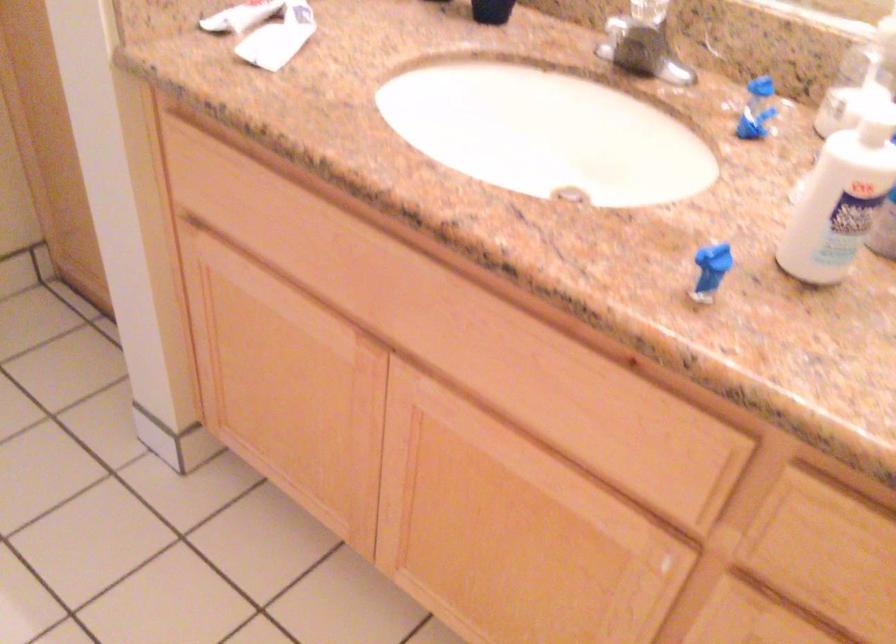
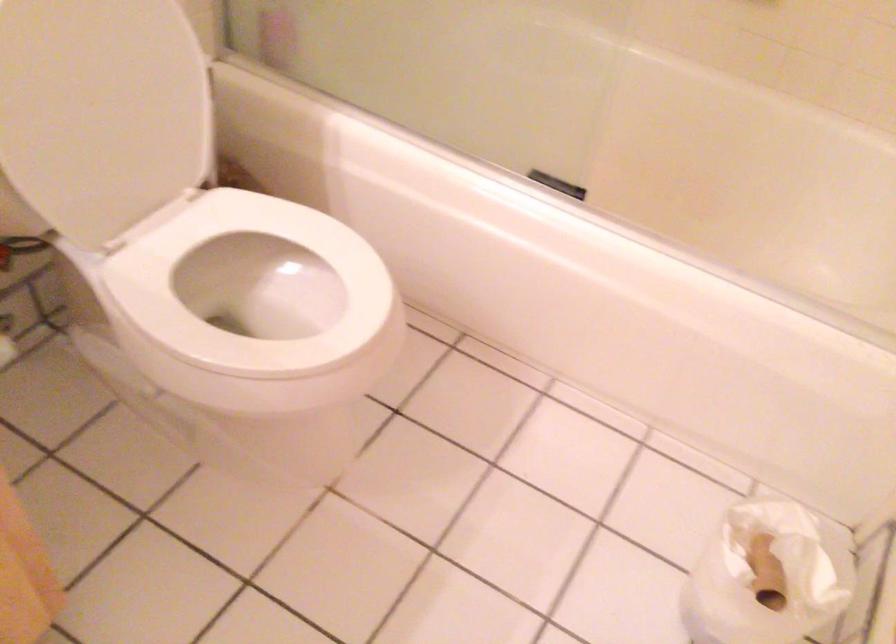
How did the camera likely rotate?

The camera's rotation is toward right-down.